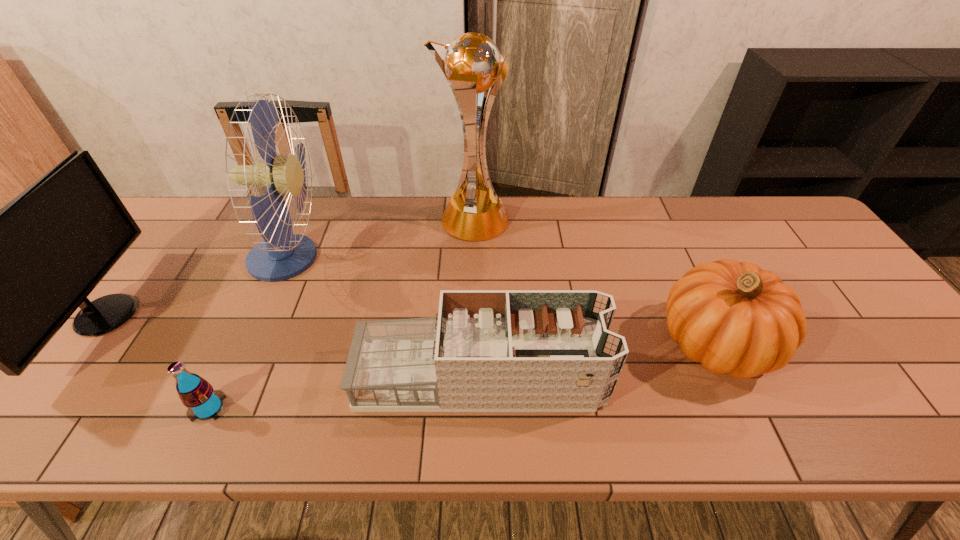
The height and width of the screenshot is (540, 960). I want to click on vacant region located 0.230m on the front-facing side of the computer monitor, so click(225, 315).

The image size is (960, 540). In order to click on vacant area situated on the right of the rightmost object in this screenshot , I will do `click(799, 343)`.

This screenshot has width=960, height=540. In order to click on free space located 0.250m at the entrance of the dollhouse in this screenshot , I will do `click(713, 379)`.

Locate an element on the screen. The height and width of the screenshot is (540, 960). vacant space positioned on the left of the soda is located at coordinates (161, 408).

Locate an element on the screen. Image resolution: width=960 pixels, height=540 pixels. trophy present at the far edge is located at coordinates (472, 64).

Where is `fan positioned at the far edge`? This screenshot has height=540, width=960. fan positioned at the far edge is located at coordinates (282, 255).

Find the location of a particular element. dollhouse at the near edge is located at coordinates (486, 350).

The image size is (960, 540). What are the coordinates of `soda that is at the near edge` in the screenshot? It's located at pos(203,402).

Find the location of `object that is at the left edge`. object that is at the left edge is located at coordinates (0, 283).

In the image, there is a desktop. Identify the location of vacant space at the far edge. The height and width of the screenshot is (540, 960). (543, 240).